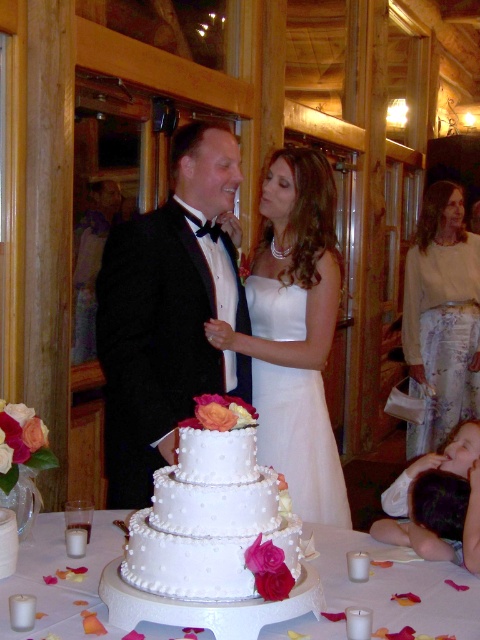
Question: Where is white textured cake at center located in relation to white satin wedding dress at center in the image?

Choices:
 (A) right
 (B) left

Answer: (B)

Question: Which object is closer to the camera taking this photo?

Choices:
 (A) white pearl cake at center
 (B) white satin wedding dress at center
 (C) white textured cake at center

Answer: (A)

Question: Is the position of white textured cake at center less distant than that of white satin wedding dress at center?

Choices:
 (A) no
 (B) yes

Answer: (B)

Question: Is white textured cake at center positioned before white pearl cake at center?

Choices:
 (A) yes
 (B) no

Answer: (B)

Question: Which object is farther from the camera taking this photo?

Choices:
 (A) white pearl cake at center
 (B) white satin wedding dress at center
 (C) white textured cake at center
 (D) white floral pants at right

Answer: (D)

Question: Which object appears farthest from the camera in this image?

Choices:
 (A) white satin dress at center
 (B) white satin wedding dress at center
 (C) white floral pants at right

Answer: (C)